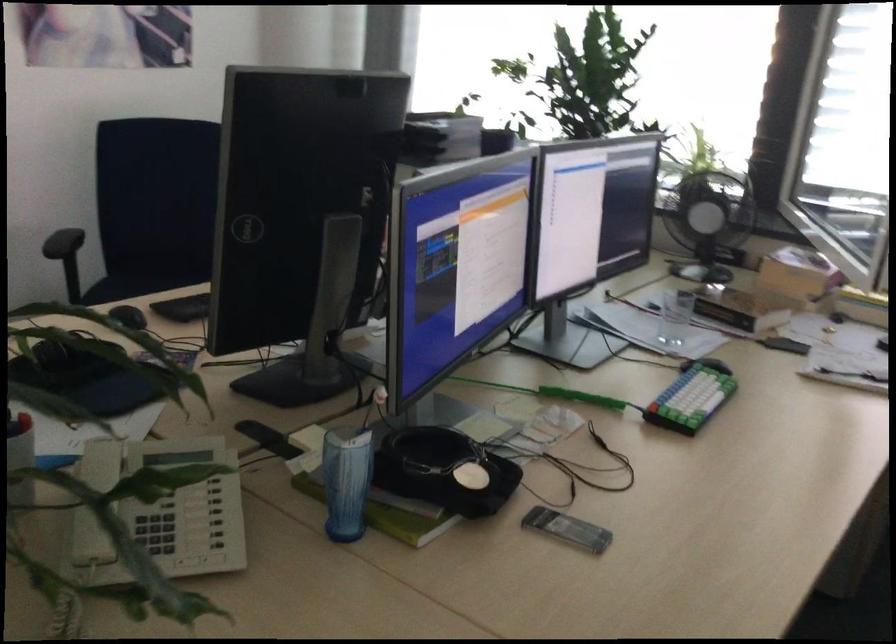
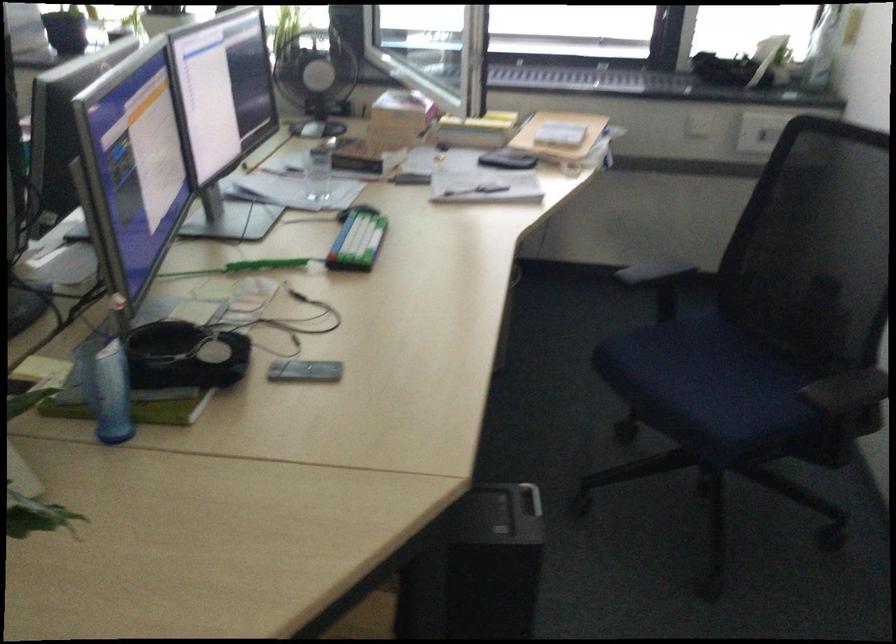
Locate, in the second image, the point that corresponds to (688,395) in the first image.

(357, 240)